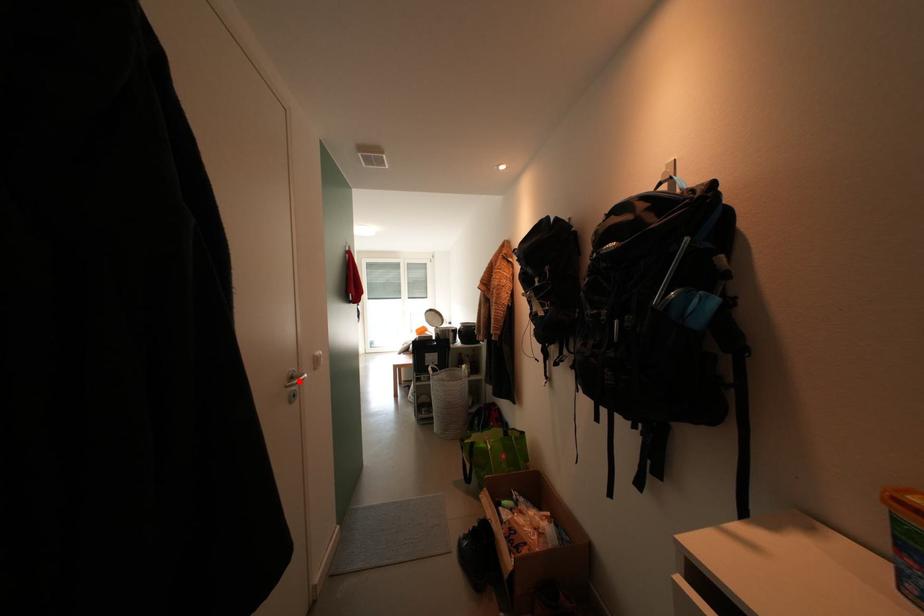
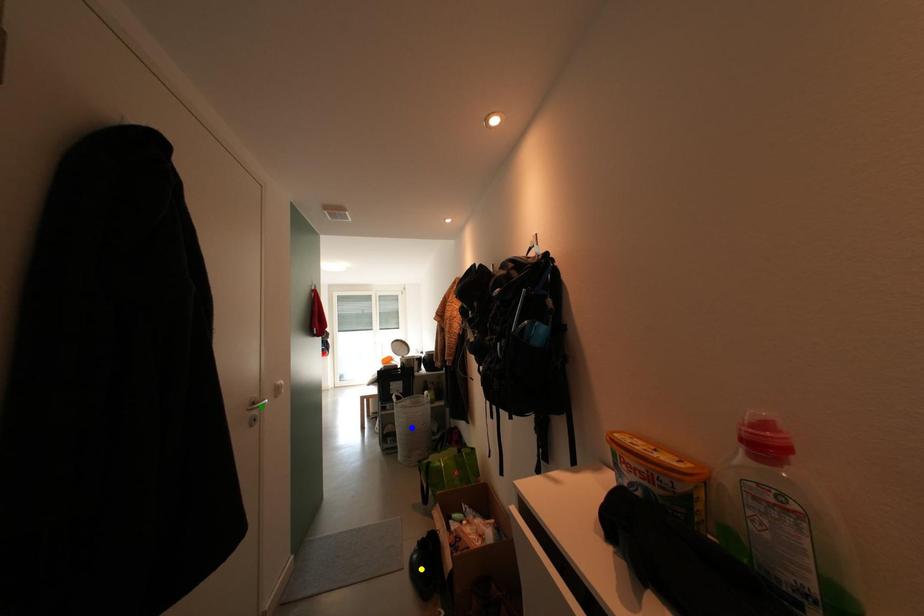
Question: I am providing you with two images of the same scene from different viewpoints. A red point is marked on the first image. You are given multiple points on the second image. Which point in image 2 is actually the same real-world point as the red point in image 1?

Choices:
 (A) green point
 (B) yellow point
 (C) blue point

Answer: (A)